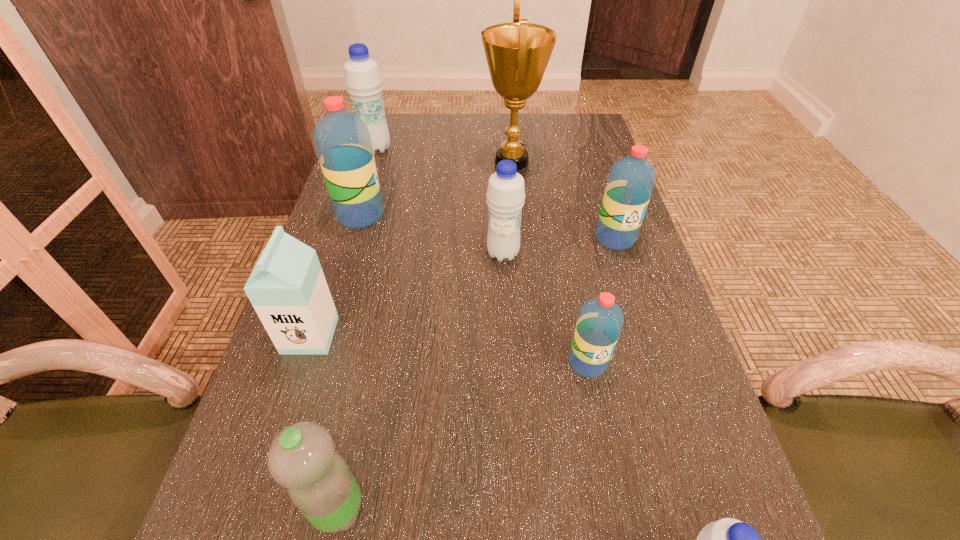
Identify the location of milk carton. (287, 288).

You are a GUI agent. You are given a task and a screenshot of the screen. Output one action in this format:
    pyautogui.click(x=<x>, y=<y>)
    Task: Click on the third nearest water bottle
    This screenshot has height=540, width=960.
    Given the screenshot: What is the action you would take?
    pyautogui.click(x=600, y=321)

Identify the location of the second red water bottle from right to left. The width and height of the screenshot is (960, 540). (600, 321).

This screenshot has width=960, height=540. Identify the location of free space located on the front view with handles of the award. (449, 161).

Image resolution: width=960 pixels, height=540 pixels. I want to click on free space located 0.160m on the front view with handles of the award, so click(425, 161).

At what (x,y) coordinates should I click in order to perform the action: click on blank area located on the front view with handles of the award. Please return your answer as a coordinate pair (x, y). Looking at the image, I should click on (425, 161).

The height and width of the screenshot is (540, 960). Find the location of `blank space located 0.220m on the front of the farthest blue water bottle`. blank space located 0.220m on the front of the farthest blue water bottle is located at coordinates (359, 202).

Where is `vacant space located 0.130m on the front label of the biggest red water bottle`? Image resolution: width=960 pixels, height=540 pixels. vacant space located 0.130m on the front label of the biggest red water bottle is located at coordinates (436, 215).

This screenshot has width=960, height=540. I want to click on vacant space located on the front label of the second biggest red water bottle, so click(x=643, y=328).

Locate an element on the screen. This screenshot has height=540, width=960. vacant space located 0.330m on the front of the second blue water bottle from right to left is located at coordinates (511, 399).